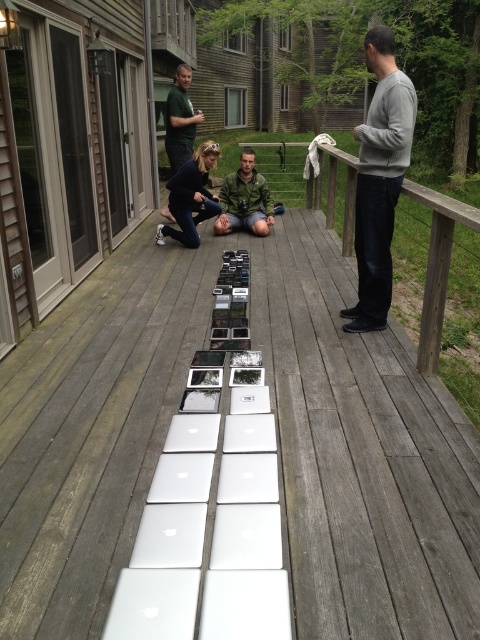
Does wooden at right have a lesser height compared to green matte jacket at center?

Correct, wooden at right is not as tall as green matte jacket at center.

Does wooden at right have a lesser width compared to green matte jacket at center?

Indeed, wooden at right has a lesser width compared to green matte jacket at center.

Is point (327, 145) closer to camera compared to point (250, 176)?

No.

Where is `wooden at right`? wooden at right is located at coordinates (436, 266).

Where is `matte black jacket at center`? This screenshot has width=480, height=640. matte black jacket at center is located at coordinates (191, 196).

Between point (184, 189) and point (166, 134), which one is positioned behind?

The point (166, 134) is behind.

What do you see at coordinates (191, 196) in the screenshot? The image size is (480, 640). I see `matte black jacket at center` at bounding box center [191, 196].

Locate an element on the screen. matte black jacket at center is located at coordinates (191, 196).

Can you confirm if matte black jacket at center is positioned to the left of green matte jacket at center?

Yes, matte black jacket at center is to the left of green matte jacket at center.

Is point (202, 209) positioned after point (262, 186)?

No, (202, 209) is in front of (262, 186).

Is point (207, 161) closer to camera compared to point (272, 211)?

Yes, it is in front of point (272, 211).

You are a GUI agent. You are given a task and a screenshot of the screen. Output one action in this format:
    pyautogui.click(x=<x>, y=<y>)
    Task: Click on the matte black jacket at center
    
    Given the screenshot: What is the action you would take?
    pyautogui.click(x=191, y=196)